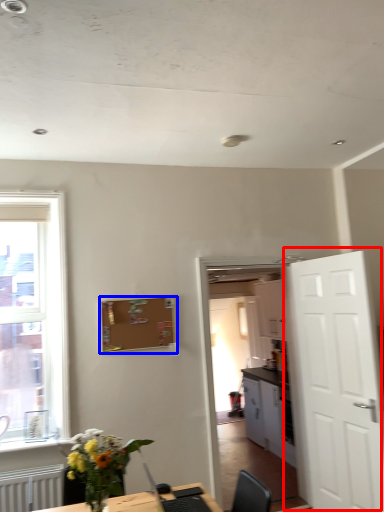
Question: Which object is further to the camera taking this photo, door (highlighted by a red box) or bulletin board (highlighted by a blue box)?

Choices:
 (A) door
 (B) bulletin board

Answer: (B)